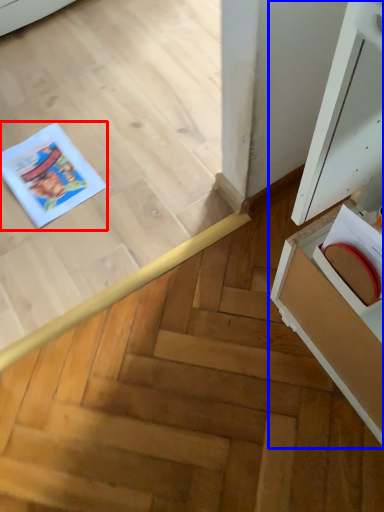
Question: Among these objects, which one is farthest to the camera, comic book (highlighted by a red box) or cabinetry (highlighted by a blue box)?

Choices:
 (A) comic book
 (B) cabinetry

Answer: (A)